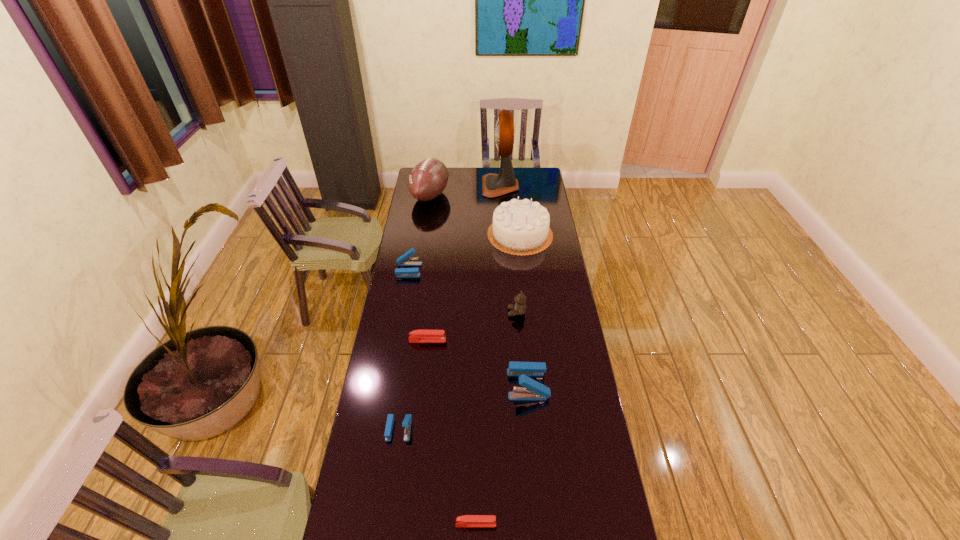
This screenshot has width=960, height=540. In order to click on brown fan in this screenshot , I will do `click(493, 185)`.

The image size is (960, 540). Identify the location of the tallest object. (493, 185).

Find the location of a particular element. The image size is (960, 540). football (American) is located at coordinates (428, 179).

At what (x,y) coordinates should I click in order to perform the action: click on birthday cake. Please return your answer as a coordinate pair (x, y). The height and width of the screenshot is (540, 960). Looking at the image, I should click on (520, 227).

Where is `the third nearest object`? The width and height of the screenshot is (960, 540). the third nearest object is located at coordinates (534, 391).

Find the location of a particular element. Image resolution: width=960 pixels, height=540 pixels. the biggest blue stapler is located at coordinates (534, 391).

Image resolution: width=960 pixels, height=540 pixels. Identify the location of the fifth nearest object. (519, 308).

Identify the location of teddy bear. Image resolution: width=960 pixels, height=540 pixels. (519, 308).

Identify the location of the farthest stapler. The height and width of the screenshot is (540, 960). (403, 260).

Where is `the fourth shortest object`? This screenshot has height=540, width=960. the fourth shortest object is located at coordinates (403, 260).